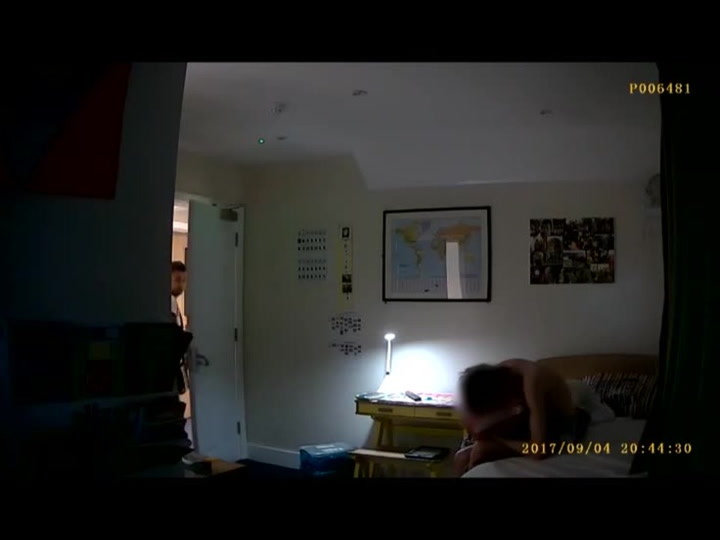
Image resolution: width=720 pixels, height=540 pixels. What are the coordinates of `ceiling` in the screenshot? It's located at (428, 148).